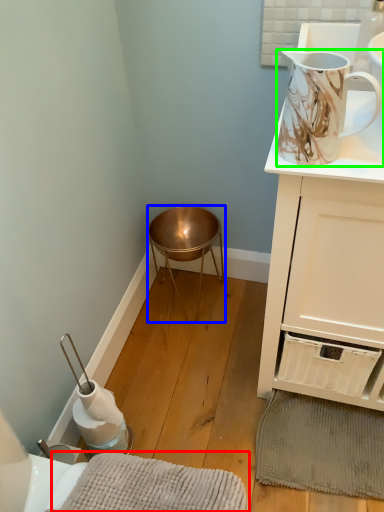
Question: Considering the real-world distances, which object is closest to bath mat (highlighted by a red box)? stool (highlighted by a blue box) or jug (highlighted by a green box).

Choices:
 (A) stool
 (B) jug

Answer: (B)